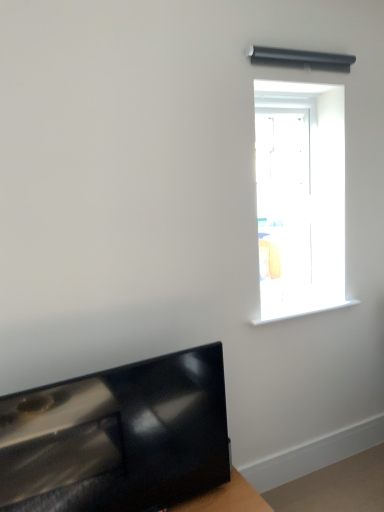
Question: Is white plastic window sill at upper right positioned far away from glossy black tv at lower left?

Choices:
 (A) no
 (B) yes

Answer: (A)

Question: From the image's perspective, is white plastic window sill at upper right on glossy black tv at lower left?

Choices:
 (A) no
 (B) yes

Answer: (B)

Question: Considering the relative positions of white plastic window sill at upper right and glossy black tv at lower left in the image provided, is white plastic window sill at upper right to the right of glossy black tv at lower left from the viewer's perspective?

Choices:
 (A) no
 (B) yes

Answer: (B)

Question: Considering the relative positions of white plastic window sill at upper right and glossy black tv at lower left in the image provided, is white plastic window sill at upper right to the left of glossy black tv at lower left from the viewer's perspective?

Choices:
 (A) no
 (B) yes

Answer: (A)

Question: Is white plastic window sill at upper right placed right next to glossy black tv at lower left?

Choices:
 (A) yes
 (B) no

Answer: (B)

Question: Would you say transparent glass door at upper right is inside or outside glossy black tv at lower left?

Choices:
 (A) outside
 (B) inside

Answer: (A)

Question: From the image's perspective, relative to glossy black tv at lower left, is transparent glass door at upper right above or below?

Choices:
 (A) below
 (B) above

Answer: (B)

Question: In terms of width, does transparent glass door at upper right look wider or thinner when compared to glossy black tv at lower left?

Choices:
 (A) thin
 (B) wide

Answer: (B)

Question: Based on their sizes in the image, would you say transparent glass door at upper right is bigger or smaller than glossy black tv at lower left?

Choices:
 (A) small
 (B) big

Answer: (B)

Question: From a real-world perspective, relative to white plastic window sill at upper right, is glossy black tv at lower left vertically above or below?

Choices:
 (A) below
 (B) above

Answer: (A)

Question: Is glossy black tv at lower left inside or outside of white plastic window sill at upper right?

Choices:
 (A) inside
 (B) outside

Answer: (B)

Question: Is glossy black tv at lower left in front of or behind white plastic window sill at upper right in the image?

Choices:
 (A) front
 (B) behind

Answer: (A)

Question: Is glossy black tv at lower left bigger or smaller than white plastic window sill at upper right?

Choices:
 (A) small
 (B) big

Answer: (B)

Question: Is transparent glass door at upper right taller or shorter than white plastic window sill at upper right?

Choices:
 (A) tall
 (B) short

Answer: (A)

Question: Is point (309, 293) closer or farther from the camera than point (274, 316)?

Choices:
 (A) farther
 (B) closer

Answer: (A)